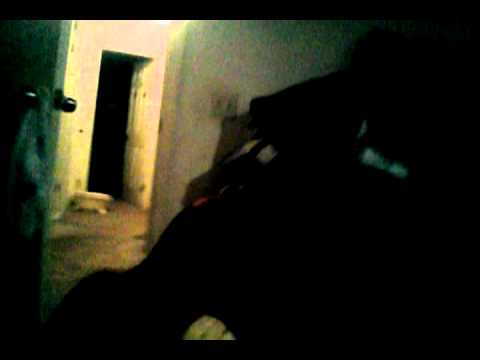
The image size is (480, 360). Identify the location of wall. (76, 77).